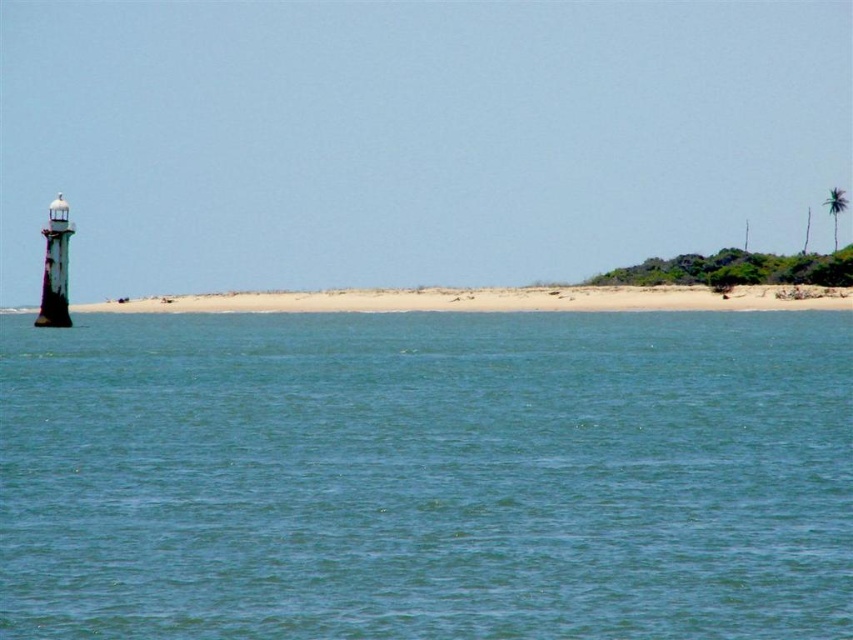
Can you confirm if blue water at center is bigger than beige sand beach at center?

Yes, blue water at center is bigger than beige sand beach at center.

Who is shorter, blue water at center or beige sand beach at center?

beige sand beach at center

Is point (503, 362) closer to viewer compared to point (816, 304)?

Yes.

Where is `blue water at center`? The height and width of the screenshot is (640, 853). blue water at center is located at coordinates (426, 476).